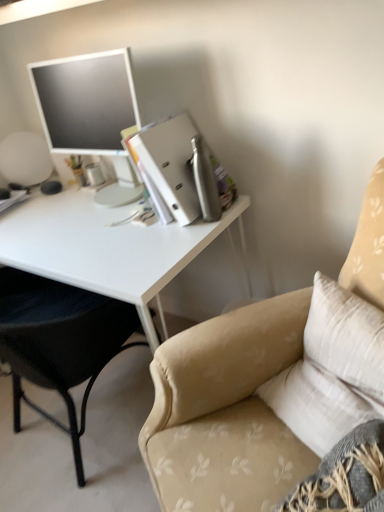
The height and width of the screenshot is (512, 384). I want to click on white glossy desk at left, so click(x=105, y=247).

From the picture: What is the approximate height of matte silver monitor at upper left?

It is 20.53 inches.

Find the location of a particular element. The height and width of the screenshot is (512, 384). white glossy desk at left is located at coordinates (105, 247).

The width and height of the screenshot is (384, 512). Find the location of `binder above the white glossy desk at left (from the image's perspective)`. binder above the white glossy desk at left (from the image's perspective) is located at coordinates (167, 167).

From a real-world perspective, is metallic silver binder at upper right above or below white glossy desk at left?

Clearly, from a real-world perspective, metallic silver binder at upper right is above white glossy desk at left.

From the image's perspective, which one is positioned lower, metallic silver binder at upper right or white glossy desk at left?

white glossy desk at left is shown below in the image.

Does metallic silver binder at upper right have a smaller size compared to white glossy desk at left?

Yes.

Between white glossy desk at left and beige fabric chair at upper right, which appears as the 1th chair when viewed from the right, which one appears on the right side from the viewer's perspective?

From the viewer's perspective, beige fabric chair at upper right, which appears as the 1th chair when viewed from the right, appears more on the right side.

Considering the positions of point (8, 244) and point (190, 410), is point (8, 244) closer or farther from the camera than point (190, 410)?

Point (8, 244) is positioned farther from the camera compared to point (190, 410).

Can you confirm if white glossy desk at left is smaller than beige fabric chair at upper right, which appears as the 1th chair when viewed from the right?

Yes.

How many degrees apart are the facing directions of white glossy desk at left and beige fabric chair at upper right, acting as the 2th chair starting from the left?

29.7 degrees separate the facing orientations of white glossy desk at left and beige fabric chair at upper right, acting as the 2th chair starting from the left.

Can you confirm if metallic silver binder at upper right is positioned to the left of beige fabric chair at upper right, acting as the 2th chair starting from the left?

Indeed, metallic silver binder at upper right is positioned on the left side of beige fabric chair at upper right, acting as the 2th chair starting from the left.

Is metallic silver binder at upper right inside the boundaries of beige fabric chair at upper right, which appears as the 1th chair when viewed from the right, or outside?

metallic silver binder at upper right is located beyond the bounds of beige fabric chair at upper right, which appears as the 1th chair when viewed from the right.

From a real-world perspective, is metallic silver binder at upper right located beneath beige fabric chair at upper right, which appears as the 1th chair when viewed from the right?

Incorrect, from a real-world perspective, metallic silver binder at upper right is higher than beige fabric chair at upper right, which appears as the 1th chair when viewed from the right.

From their relative heights in the image, would you say metallic silver binder at upper right is taller or shorter than beige fabric chair at upper right, which appears as the 1th chair when viewed from the right?

In the image, metallic silver binder at upper right appears to be shorter than beige fabric chair at upper right, which appears as the 1th chair when viewed from the right.

From the picture: From a real-world perspective, is beige fabric chair at upper right, which appears as the 1th chair when viewed from the right, positioned above or below metallic silver binder at upper right?

In terms of real-world spatial position, beige fabric chair at upper right, which appears as the 1th chair when viewed from the right, is below metallic silver binder at upper right.

Which point is more distant from viewer, (195, 439) or (170, 165)?

Point (170, 165)

Would you say beige fabric chair at upper right, which appears as the 1th chair when viewed from the right, is outside metallic silver binder at upper right?

Absolutely, beige fabric chair at upper right, which appears as the 1th chair when viewed from the right, is external to metallic silver binder at upper right.

Which of these two, beige fabric chair at upper right, acting as the 2th chair starting from the left, or metallic silver binder at upper right, is thinner?

With smaller width is metallic silver binder at upper right.

From the image's perspective, which one is positioned higher, beige fabric chair at left, the first chair positioned from the left, or beige fabric chair at upper right, which appears as the 1th chair when viewed from the right?

beige fabric chair at left, the first chair positioned from the left, is shown above in the image.

From a real-world perspective, relative to beige fabric chair at upper right, acting as the 2th chair starting from the left, is beige fabric chair at left, which is the 2th chair in right-to-left order, vertically above or below?

beige fabric chair at left, which is the 2th chair in right-to-left order, is situated lower than beige fabric chair at upper right, acting as the 2th chair starting from the left, in the real world.

From their relative heights in the image, would you say beige fabric chair at left, which is the 2th chair in right-to-left order, is taller or shorter than beige fabric chair at upper right, which appears as the 1th chair when viewed from the right?

Considering their sizes, beige fabric chair at left, which is the 2th chair in right-to-left order, has less height than beige fabric chair at upper right, which appears as the 1th chair when viewed from the right.

Considering the sizes of objects beige fabric chair at left, which is the 2th chair in right-to-left order, and beige fabric chair at upper right, which appears as the 1th chair when viewed from the right, in the image provided, who is bigger, beige fabric chair at left, which is the 2th chair in right-to-left order, or beige fabric chair at upper right, which appears as the 1th chair when viewed from the right,?

beige fabric chair at upper right, which appears as the 1th chair when viewed from the right, is bigger.

Between white glossy desk at left and matte silver monitor at upper left, which one has less height?

matte silver monitor at upper left is shorter.

Would you say white glossy desk at left is inside or outside matte silver monitor at upper left?

white glossy desk at left is not inside matte silver monitor at upper left, it's outside.

Considering the sizes of white glossy desk at left and matte silver monitor at upper left in the image, is white glossy desk at left bigger or smaller than matte silver monitor at upper left?

white glossy desk at left is bigger than matte silver monitor at upper left.

Looking at this image, considering the sizes of objects white glossy desk at left and matte silver monitor at upper left in the image provided, who is wider, white glossy desk at left or matte silver monitor at upper left?

With larger width is white glossy desk at left.

Which is in front, metallic silver binder at upper right or matte silver monitor at upper left?

matte silver monitor at upper left is closer to the camera.

Does metallic silver binder at upper right have a greater width compared to matte silver monitor at upper left?

Indeed, metallic silver binder at upper right has a greater width compared to matte silver monitor at upper left.

From the image's perspective, is metallic silver binder at upper right above or below matte silver monitor at upper left?

Based on their image positions, metallic silver binder at upper right is located beneath matte silver monitor at upper left.

Which is in front, point (143, 131) or point (57, 149)?

The point (143, 131) is in front.

Image resolution: width=384 pixels, height=512 pixels. I want to click on binder above the white glossy desk at left (from a real-world perspective), so click(167, 167).

You are a GUI agent. You are given a task and a screenshot of the screen. Output one action in this format:
    pyautogui.click(x=<x>, y=<y>)
    Task: Click on the desk behind the beige fabric chair at upper right, acting as the 2th chair starting from the left
    This screenshot has width=384, height=512.
    Given the screenshot: What is the action you would take?
    pyautogui.click(x=105, y=247)

Estimate the real-world distances between objects in this image. Which object is further from beige fabric chair at left, the first chair positioned from the left, metallic silver binder at upper right or beige fabric chair at upper right, acting as the 2th chair starting from the left?

Based on the image, metallic silver binder at upper right appears to be further to beige fabric chair at left, the first chair positioned from the left.

Looking at the image, which one is located closer to white glossy desk at left, matte silver monitor at upper left or beige fabric chair at upper right, acting as the 2th chair starting from the left?

matte silver monitor at upper left is closer to white glossy desk at left.

Estimate the real-world distances between objects in this image. Which object is closer to white glossy desk at left, matte silver monitor at upper left or beige fabric chair at left, the first chair positioned from the left?

The object closer to white glossy desk at left is beige fabric chair at left, the first chair positioned from the left.

From the image, which object appears to be nearer to beige fabric chair at upper right, which appears as the 1th chair when viewed from the right, matte silver monitor at upper left or white glossy desk at left?

white glossy desk at left is closer to beige fabric chair at upper right, which appears as the 1th chair when viewed from the right.

Estimate the real-world distances between objects in this image. Which object is further from white glossy desk at left, beige fabric chair at upper right, which appears as the 1th chair when viewed from the right, or beige fabric chair at left, the first chair positioned from the left?

beige fabric chair at upper right, which appears as the 1th chair when viewed from the right, is positioned further to the anchor white glossy desk at left.

Looking at the image, which one is located closer to beige fabric chair at left, which is the 2th chair in right-to-left order, metallic silver binder at upper right or white glossy desk at left?

Among the two, white glossy desk at left is located nearer to beige fabric chair at left, which is the 2th chair in right-to-left order.

Looking at the image, which one is located closer to metallic silver binder at upper right, matte silver monitor at upper left or beige fabric chair at upper right, which appears as the 1th chair when viewed from the right?

Based on the image, matte silver monitor at upper left appears to be nearer to metallic silver binder at upper right.

Based on the photo, based on their spatial positions, is beige fabric chair at upper right, acting as the 2th chair starting from the left, or matte silver monitor at upper left closer to beige fabric chair at left, the first chair positioned from the left?

beige fabric chair at upper right, acting as the 2th chair starting from the left, is positioned closer to the anchor beige fabric chair at left, the first chair positioned from the left.

I want to click on television between beige fabric chair at upper right, acting as the 2th chair starting from the left, and metallic silver binder at upper right, along the z-axis, so click(x=90, y=112).

Identify the location of binder between matte silver monitor at upper left and beige fabric chair at left, the first chair positioned from the left, vertically. This screenshot has width=384, height=512. (167, 167).

The height and width of the screenshot is (512, 384). In order to click on desk between beige fabric chair at upper right, which appears as the 1th chair when viewed from the right, and metallic silver binder at upper right from front to back in this screenshot , I will do `click(105, 247)`.

Find the location of a particular element. The image size is (384, 512). desk between beige fabric chair at left, the first chair positioned from the left, and beige fabric chair at upper right, which appears as the 1th chair when viewed from the right is located at coordinates (105, 247).